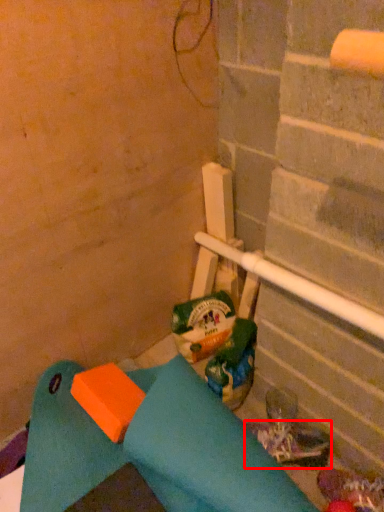
Question: From the image's perspective, where is footwear (annotated by the red box) located relative to garbage?

Choices:
 (A) below
 (B) above

Answer: (A)